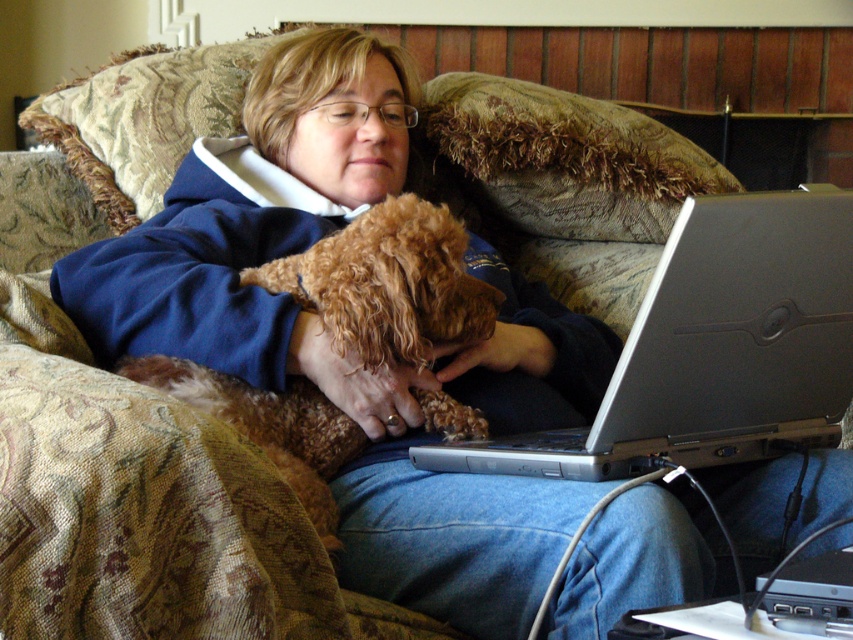
Question: Considering the relative positions of silver metallic laptop at lower right and brown curly fur dog at center in the image provided, where is silver metallic laptop at lower right located with respect to brown curly fur dog at center?

Choices:
 (A) below
 (B) above

Answer: (A)

Question: Does silver metallic laptop at lower right have a smaller size compared to brown curly fur dog at center?

Choices:
 (A) no
 (B) yes

Answer: (A)

Question: Can you confirm if silver metallic laptop at lower right is positioned to the left of brown curly fur dog at center?

Choices:
 (A) no
 (B) yes

Answer: (A)

Question: Which point appears farthest from the camera in this image?

Choices:
 (A) (772, 195)
 (B) (399, 340)

Answer: (B)

Question: Which object appears farthest from the camera in this image?

Choices:
 (A) silver metallic laptop at lower right
 (B) brown curly fur dog at center

Answer: (B)